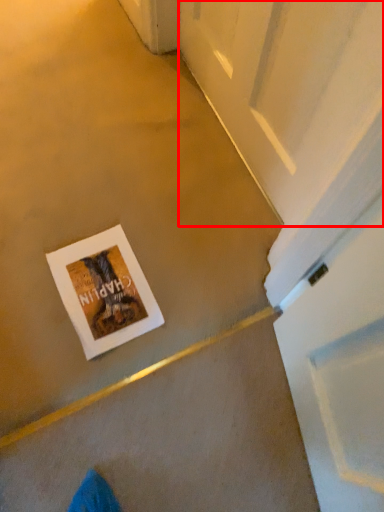
Question: From the image's perspective, what is the correct spatial positioning of screen door (annotated by the red box) in reference to postcard?

Choices:
 (A) below
 (B) above

Answer: (B)